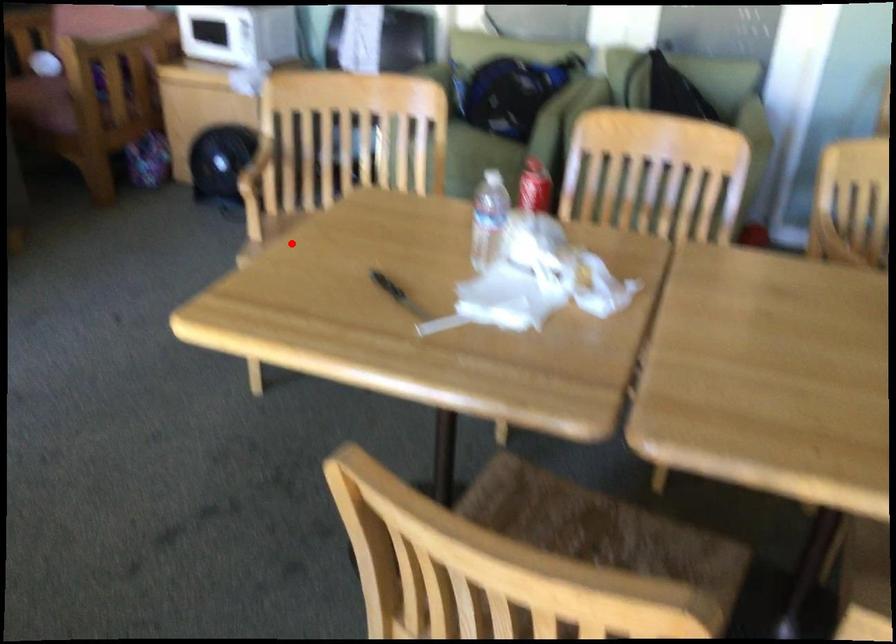
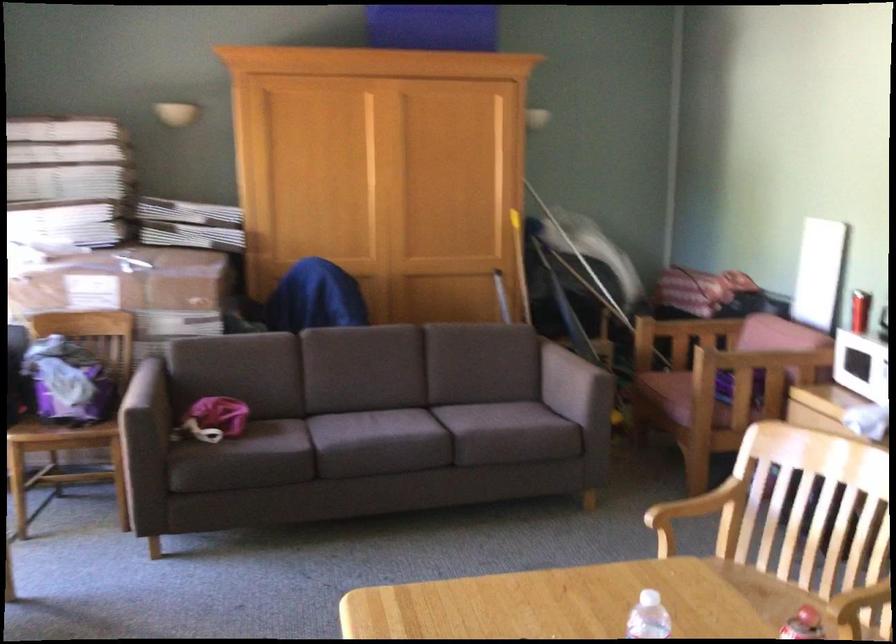
The point at the highlighted location is marked in the first image. Where is the corresponding point in the second image?

(555, 603)